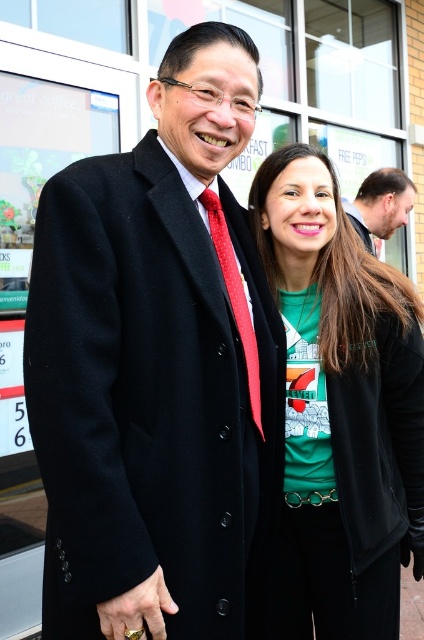
What do you see at coordinates (340, 406) in the screenshot?
I see `green matte shirt at center` at bounding box center [340, 406].

Does green matte shirt at center have a lesser height compared to dark brown leather jacket at upper right?

Incorrect, green matte shirt at center's height does not fall short of dark brown leather jacket at upper right's.

Between point (398, 560) and point (413, 193), which one is positioned in front?

Point (398, 560)

What are the coordinates of `green matte shirt at center` in the screenshot? It's located at (340, 406).

Describe the element at coordinates (340, 406) in the screenshot. I see `green matte shirt at center` at that location.

Does point (339, 314) come in front of point (236, 292)?

No, (339, 314) is further to viewer.

Is point (348, 614) positioned in front of point (251, 349)?

No, (348, 614) is behind (251, 349).

You are a GUI agent. You are given a task and a screenshot of the screen. Output one action in this format:
    pyautogui.click(x=<x>, y=<y>)
    Task: Click on the green matte shirt at center
    The width and height of the screenshot is (424, 640).
    Given the screenshot: What is the action you would take?
    pyautogui.click(x=340, y=406)

Looking at this image, measure the distance between point (223,257) and camera.

The distance of point (223,257) from camera is 1.59 meters.

The image size is (424, 640). What do you see at coordinates (234, 298) in the screenshot? I see `red dotted tie at center` at bounding box center [234, 298].

The height and width of the screenshot is (640, 424). I want to click on red dotted tie at center, so click(x=234, y=298).